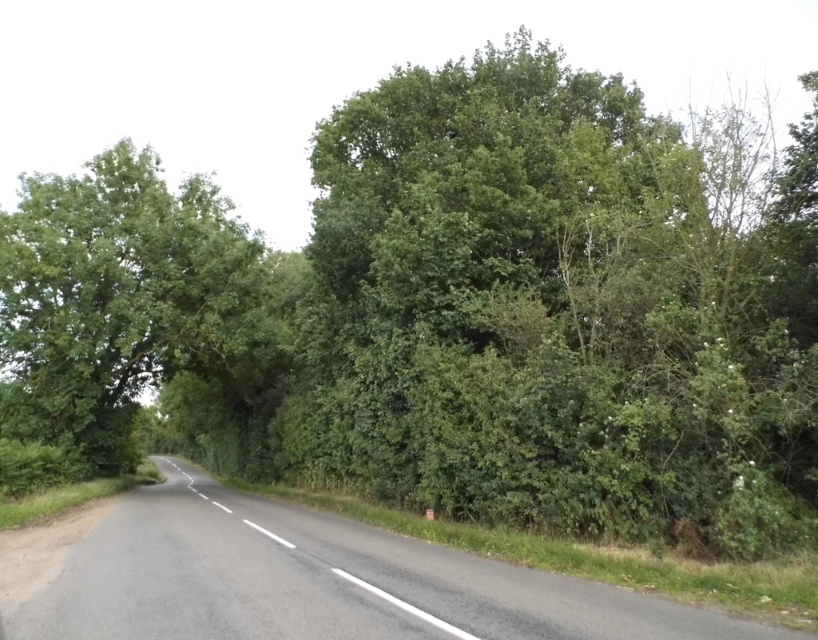
Question: Among these objects, which one is farthest from the camera?

Choices:
 (A) green leafy tree at left
 (B) black asphalt road at center

Answer: (A)

Question: Which point is closer to the camera?

Choices:
 (A) (68, 243)
 (B) (506, 605)

Answer: (B)

Question: Is black asphalt road at center positioned before green leafy tree at left?

Choices:
 (A) no
 (B) yes

Answer: (B)

Question: Can you confirm if black asphalt road at center is positioned above green leafy tree at left?

Choices:
 (A) no
 (B) yes

Answer: (A)

Question: Is black asphalt road at center further to the viewer compared to green leafy tree at left?

Choices:
 (A) yes
 (B) no

Answer: (B)

Question: Which point is farther from the camera taking this photo?

Choices:
 (A) (183, 360)
 (B) (52, 604)

Answer: (A)